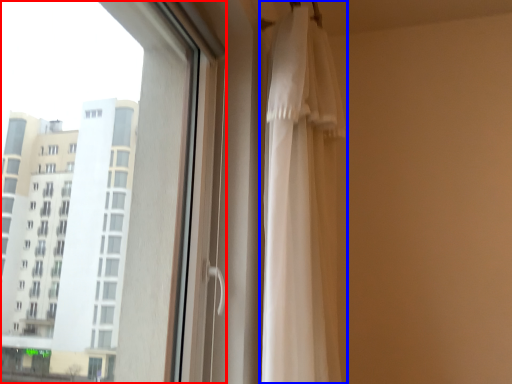
Question: Which object is closer to the camera taking this photo, window (highlighted by a red box) or curtain (highlighted by a blue box)?

Choices:
 (A) window
 (B) curtain

Answer: (A)